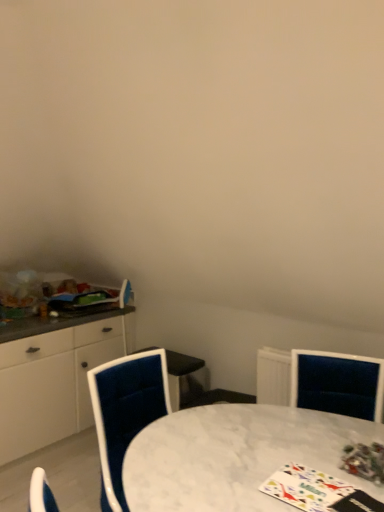
Identify the location of empty space that is ontop of white marble table at center. (247, 445).